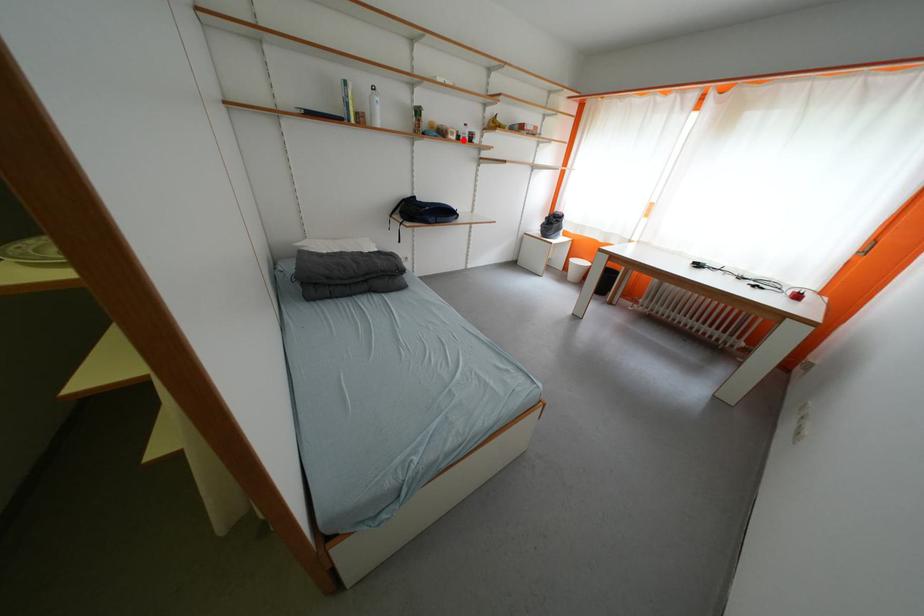
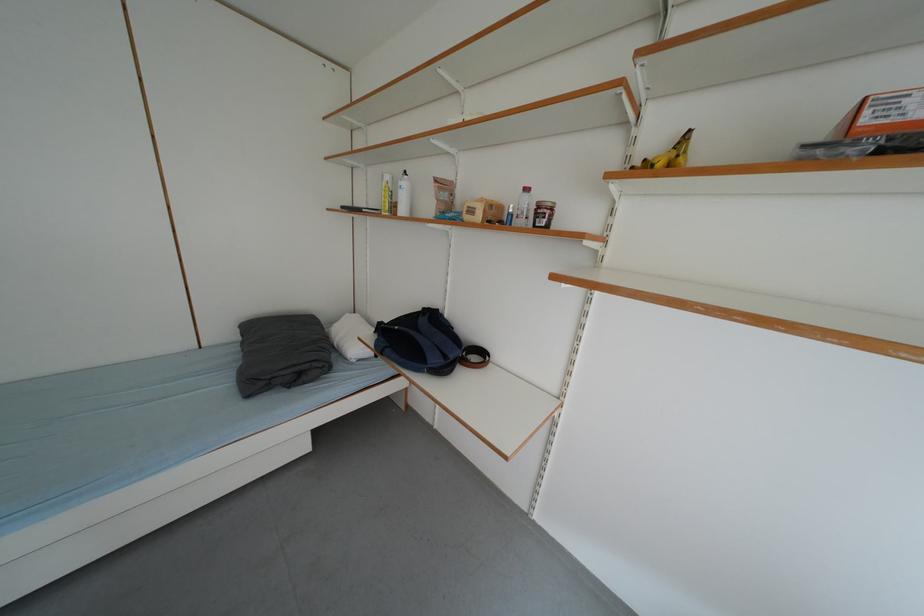
The point at the highlighted location is marked in the first image. Where is the corresponding point in the second image?

(487, 220)